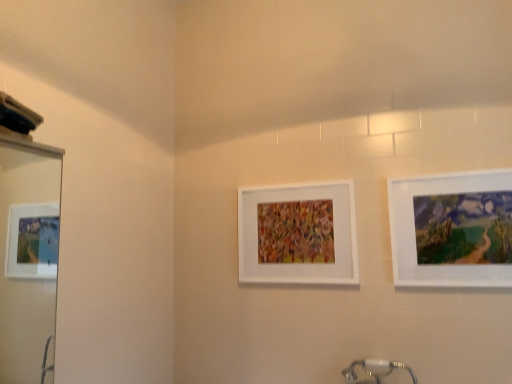
Question: Would you say white glossy mirror at left is to the left or to the right of white matte picture frame at center, arranged as the second picture frame when viewed from the front, in the picture?

Choices:
 (A) right
 (B) left

Answer: (B)

Question: Is white glossy mirror at left inside the boundaries of white matte picture frame at center, the 1th picture frame positioned from the back, or outside?

Choices:
 (A) inside
 (B) outside

Answer: (B)

Question: Which object is the closest to the white matte picture frame at center, which is counted as the first picture frame, starting from the left?

Choices:
 (A) matte white picture frame at right, the second picture frame in the back-to-front sequence
 (B) white glossy mirror at left

Answer: (A)

Question: Which object is the farthest from the matte white picture frame at right, the second picture frame in the back-to-front sequence?

Choices:
 (A) white matte picture frame at center, arranged as the second picture frame when viewed from the front
 (B) white glossy mirror at left

Answer: (B)